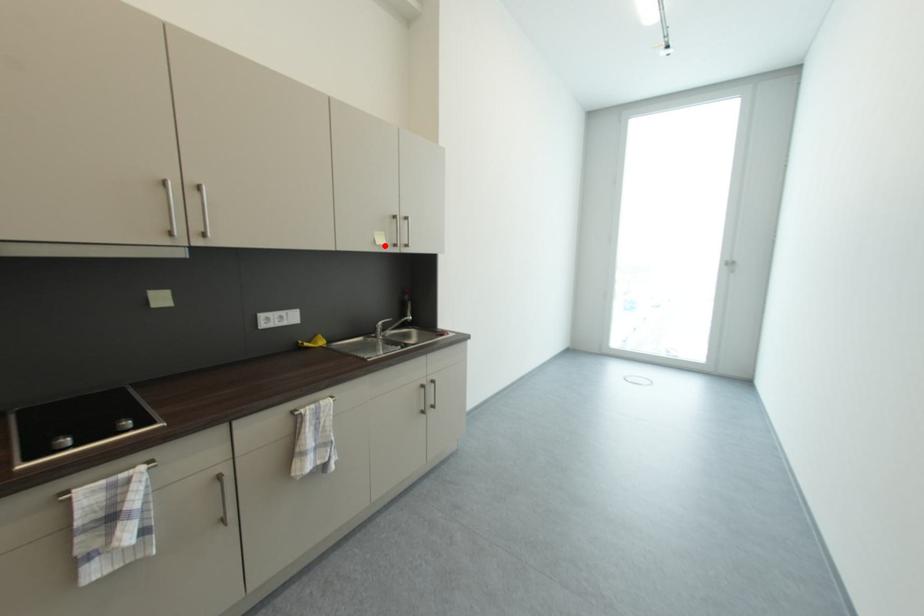
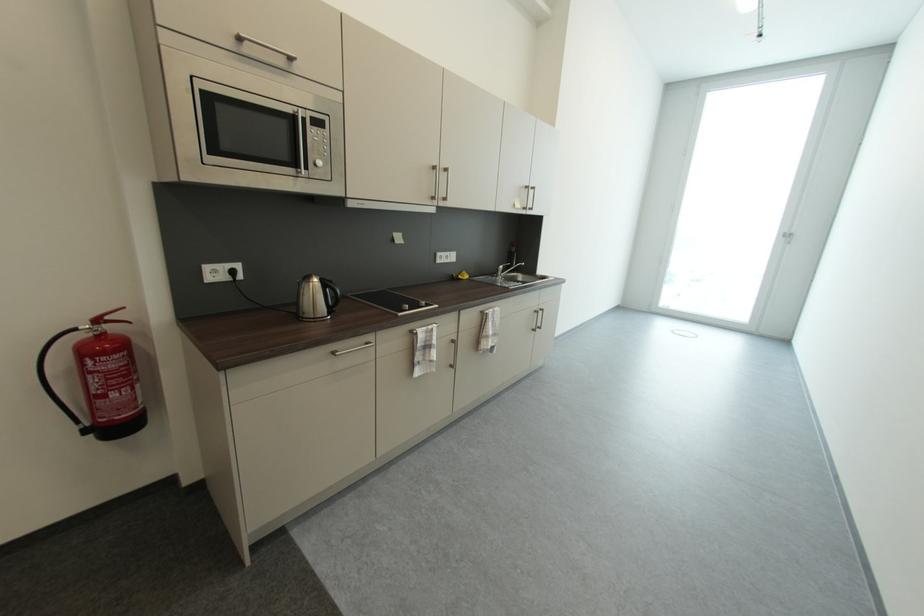
Question: I am providing you with two images of the same scene from different viewpoints. Image1 has a red point marked. In image2, the corresponding 3D location appears at what relative position? Reply with the corresponding letter.

Choices:
 (A) Closer
 (B) Farther

Answer: (A)